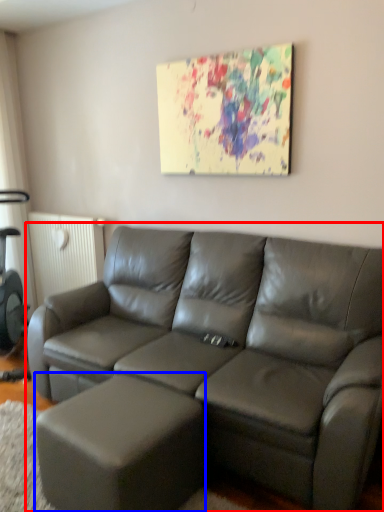
Question: Which object appears closest to the camera in this image, studio couch (highlighted by a red box) or bar stool (highlighted by a blue box)?

Choices:
 (A) studio couch
 (B) bar stool

Answer: (A)